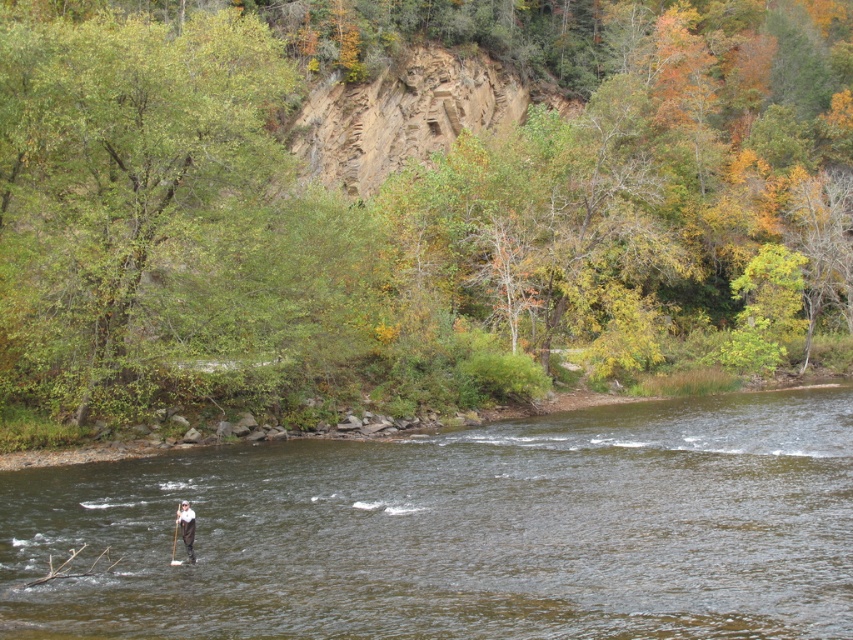
You are a kayaker navigating a river and see a green leafy tree at upper center and a wooden paddle at center. Which object is positioned to the right of the other?

The green leafy tree at upper center is to the right of the wooden paddle at center.

You are a photographer planning to capture a landscape photo of the green leafy tree at upper center and the dark gray fabric person at center. To ensure both subjects are in frame, which object should you position closer to the camera to avoid cropping?

The green leafy tree at upper center is wider than the dark gray fabric person at center. To include both in the frame, position the camera closer to the green leafy tree at upper center so its width fits without cropping.